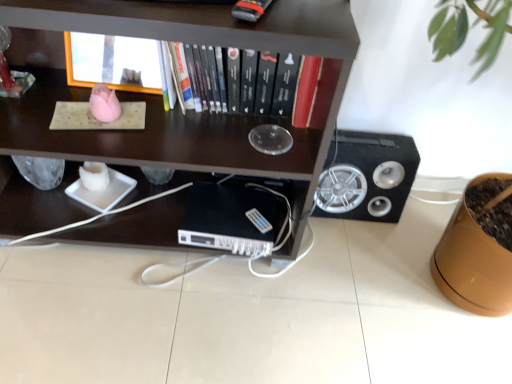
Question: Does black matte speaker at right have a larger size compared to hardcover book at center?

Choices:
 (A) yes
 (B) no

Answer: (A)

Question: Is black matte speaker at right looking in the opposite direction of hardcover book at center?

Choices:
 (A) no
 (B) yes

Answer: (A)

Question: Can you confirm if black matte speaker at right is smaller than hardcover book at center?

Choices:
 (A) no
 (B) yes

Answer: (A)

Question: Is black matte speaker at right at the right side of hardcover book at center?

Choices:
 (A) yes
 (B) no

Answer: (A)

Question: Is black matte speaker at right further to camera compared to hardcover book at center?

Choices:
 (A) yes
 (B) no

Answer: (A)

Question: Is wooden frame at upper center, the first shelf viewed from the top, inside the boundaries of dark wood shelf at upper center, arranged as the 2th shelf when viewed from the top, or outside?

Choices:
 (A) outside
 (B) inside

Answer: (B)

Question: Is wooden frame at upper center, the first shelf viewed from the top, taller or shorter than dark wood shelf at upper center, arranged as the 1th shelf when ordered from the bottom?

Choices:
 (A) short
 (B) tall

Answer: (A)

Question: Considering the positions of point (133, 66) and point (200, 6), is point (133, 66) closer or farther from the camera than point (200, 6)?

Choices:
 (A) farther
 (B) closer

Answer: (A)

Question: Is wooden frame at upper center, the first shelf viewed from the top, wider or thinner than dark wood shelf at upper center, arranged as the 2th shelf when viewed from the top?

Choices:
 (A) thin
 (B) wide

Answer: (A)

Question: From a real-world perspective, is wooden frame at upper center, the first shelf viewed from the top, positioned above or below hardcover book at center?

Choices:
 (A) below
 (B) above

Answer: (B)

Question: Based on their positions, is wooden frame at upper center, the first shelf viewed from the top, located to the left or right of hardcover book at center?

Choices:
 (A) right
 (B) left

Answer: (B)

Question: In terms of width, does wooden frame at upper center, which appears as the second shelf when ordered from the bottom, look wider or thinner when compared to hardcover book at center?

Choices:
 (A) thin
 (B) wide

Answer: (A)

Question: Considering the positions of wooden frame at upper center, which appears as the second shelf when ordered from the bottom, and hardcover book at center in the image, is wooden frame at upper center, which appears as the second shelf when ordered from the bottom, bigger or smaller than hardcover book at center?

Choices:
 (A) small
 (B) big

Answer: (A)

Question: Looking at their shapes, would you say black matte speaker at right is wider or thinner than dark wood shelf at upper center, arranged as the 1th shelf when ordered from the bottom?

Choices:
 (A) thin
 (B) wide

Answer: (A)

Question: Does point (336, 208) appear closer or farther from the camera than point (138, 157)?

Choices:
 (A) closer
 (B) farther

Answer: (B)